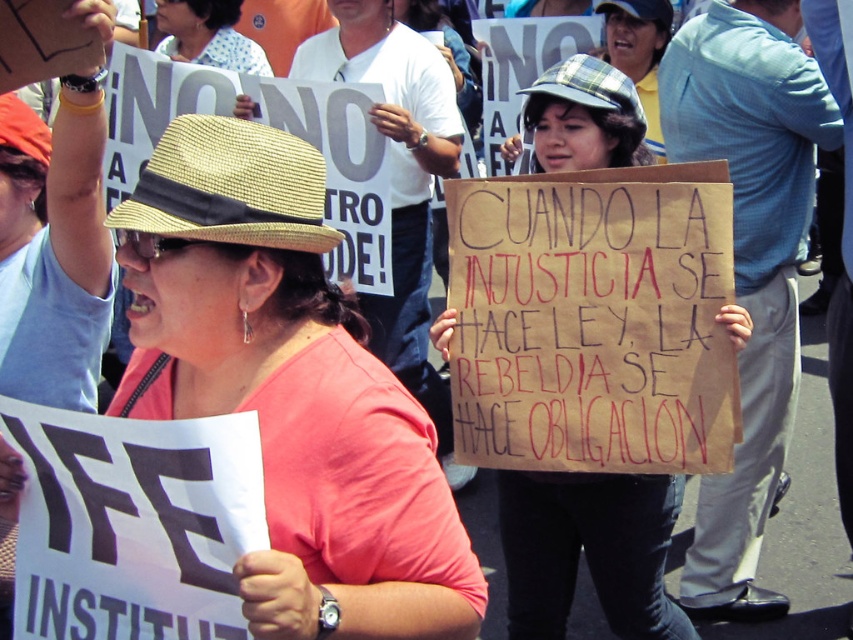
Is matte straw hat at center wider than plaid fabric hat at center?

Correct, the width of matte straw hat at center exceeds that of plaid fabric hat at center.

Image resolution: width=853 pixels, height=640 pixels. I want to click on matte straw hat at center, so click(289, 388).

In order to click on matte straw hat at center in this screenshot , I will do `click(289, 388)`.